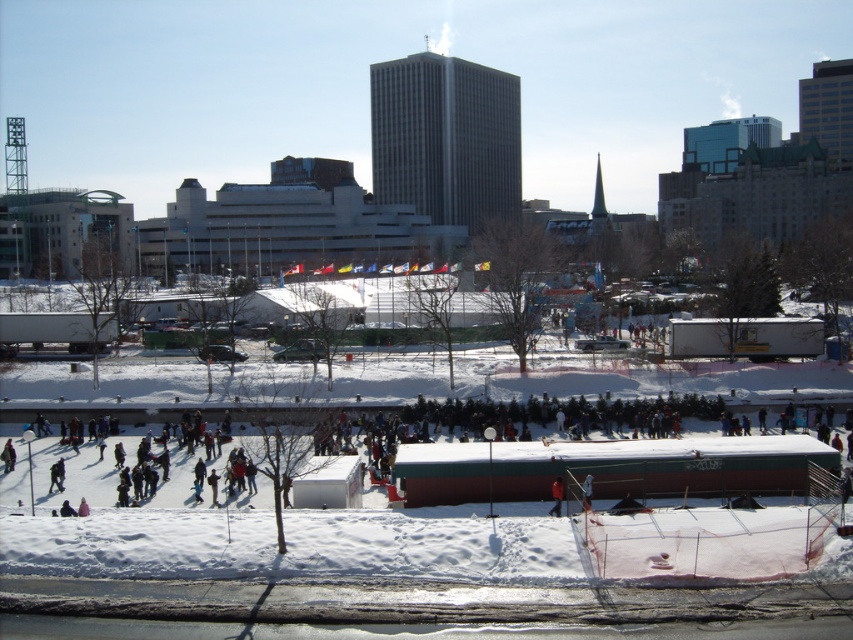
You are standing at the camera position and want to take a photo of the dark gray snowboarder at center. The camera has a maximum focus range of 60 feet. Will the camera be able to focus on the snowboarder?

The dark gray snowboarder at center is 68.33 feet from the camera, which exceeds the camera maximum focus range of 60 feet. Therefore, the camera will not be able to focus on the snowboarder.

You are standing at the edge of the snow area and want to reach the orange fabric at center without getting too close to the dark gray snowboarder at center. What is the minimum distance you need to walk to avoid the snowboarder?

The minimum distance you need to walk is 11.95 meters to avoid the dark gray snowboarder at center and reach the orange fabric at center.

You are a photographer at the winter event, and you want to capture a photo that includes both the dark gray snowboarder at center and the orange fabric at center. Which object should you focus on first if you want the snowboarder to appear larger in the photo?

The dark gray snowboarder at center is bigger than the orange fabric at center, so you should focus on the dark gray snowboarder at center first to ensure it appears larger in the photo.